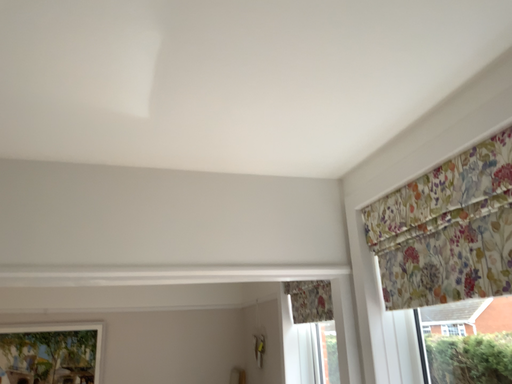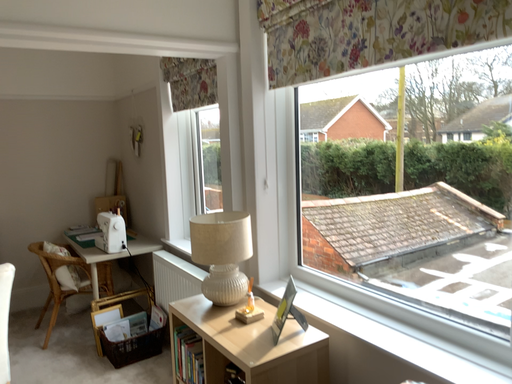
Question: How did the camera likely rotate when shooting the video?

Choices:
 (A) rotated left
 (B) rotated right

Answer: (B)